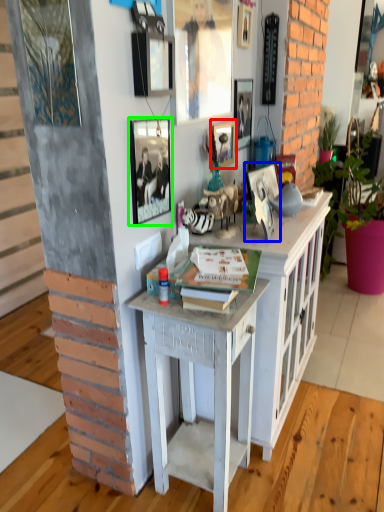
Question: Based on their relative distances, which object is nearer to picture frame (highlighted by a red box)? Choose from picture frame (highlighted by a blue box) and picture frame (highlighted by a green box).

Choices:
 (A) picture frame
 (B) picture frame

Answer: (A)